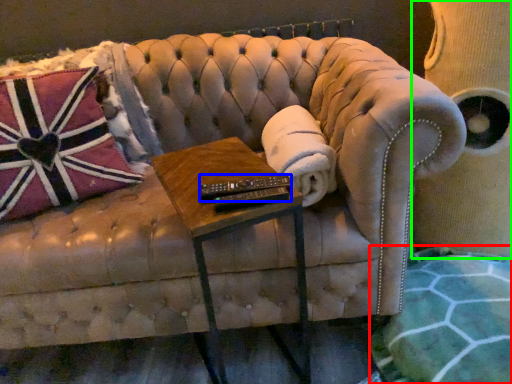
Question: Which is nearer to the blanket (highlighted by a red box)? control (highlighted by a blue box) or swivel chair (highlighted by a green box).

Choices:
 (A) control
 (B) swivel chair

Answer: (B)